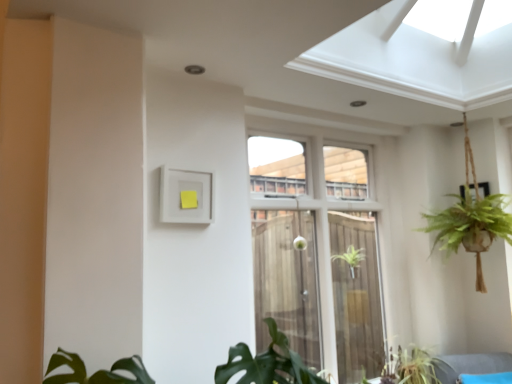
Question: Is white glass window at center inside the boundaries of green leafy plant at lower center, or outside?

Choices:
 (A) outside
 (B) inside

Answer: (A)

Question: Looking at the image, does white glass window at center seem bigger or smaller compared to green leafy plant at lower center?

Choices:
 (A) small
 (B) big

Answer: (B)

Question: From the image's perspective, is white glass window at center above or below green leafy plant at lower center?

Choices:
 (A) below
 (B) above

Answer: (B)

Question: From their relative heights in the image, would you say green leafy plant at lower center is taller or shorter than white glass window at center?

Choices:
 (A) tall
 (B) short

Answer: (B)

Question: Relative to white glass window at center, is green leafy plant at lower center in front or behind?

Choices:
 (A) behind
 (B) front

Answer: (A)

Question: Is green leafy plant at lower center situated inside white glass window at center or outside?

Choices:
 (A) outside
 (B) inside

Answer: (B)

Question: From a real-world perspective, is green leafy plant at lower center physically located above or below white glass window at center?

Choices:
 (A) below
 (B) above

Answer: (A)